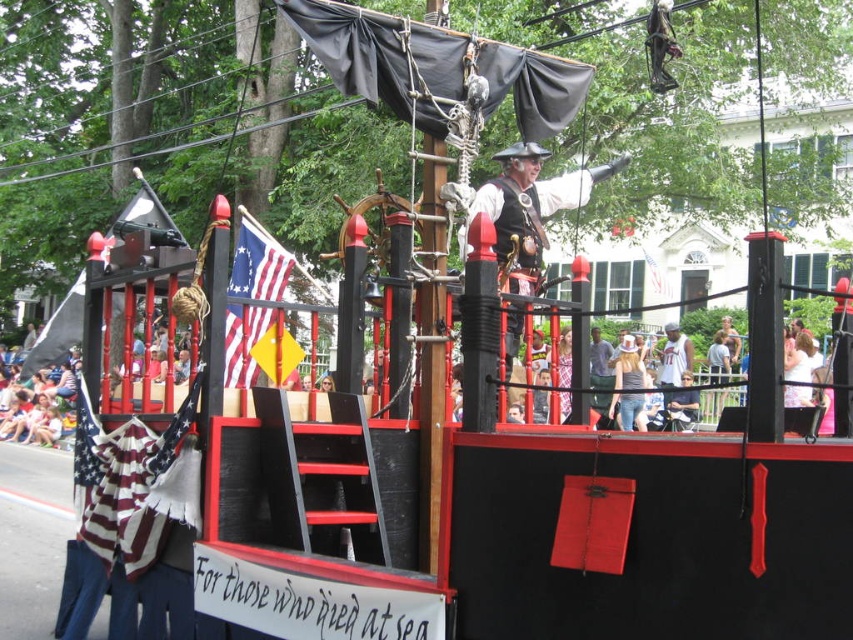
Question: Among these objects, which one is farthest from the camera?

Choices:
 (A) matte black pirate at center
 (B) american flag at center

Answer: (B)

Question: Can you confirm if matte black pirate at center is thinner than american flag at center?

Choices:
 (A) yes
 (B) no

Answer: (B)

Question: Can you confirm if matte black pirate at center is wider than american flag at center?

Choices:
 (A) yes
 (B) no

Answer: (A)

Question: Can you confirm if matte black pirate at center is wider than american flag at center?

Choices:
 (A) no
 (B) yes

Answer: (B)

Question: Which point is closer to the camera?

Choices:
 (A) (497, 250)
 (B) (238, 355)

Answer: (A)